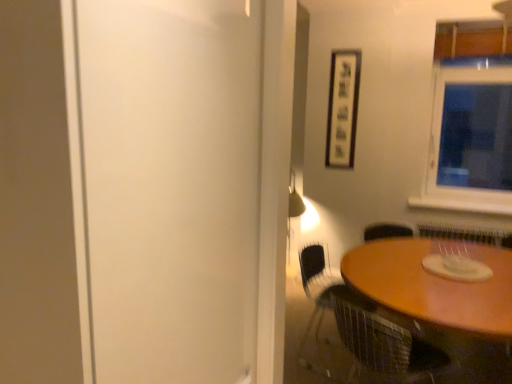
Question: Considering the relative positions of metal mesh chair at lower right and wooden table at lower right in the image provided, is metal mesh chair at lower right to the right of wooden table at lower right from the viewer's perspective?

Choices:
 (A) no
 (B) yes

Answer: (A)

Question: Can you confirm if metal mesh chair at lower right is taller than wooden table at lower right?

Choices:
 (A) no
 (B) yes

Answer: (A)

Question: From the image's perspective, is metal mesh chair at lower right located beneath wooden table at lower right?

Choices:
 (A) no
 (B) yes

Answer: (B)

Question: Is metal mesh chair at lower right touching wooden table at lower right?

Choices:
 (A) yes
 (B) no

Answer: (B)

Question: Does metal mesh chair at lower right appear on the left side of wooden table at lower right?

Choices:
 (A) yes
 (B) no

Answer: (A)

Question: Is white matte screen door at left wider or thinner than wooden table at lower right?

Choices:
 (A) thin
 (B) wide

Answer: (A)

Question: From a real-world perspective, is white matte screen door at left positioned above or below wooden table at lower right?

Choices:
 (A) below
 (B) above

Answer: (B)

Question: Is white matte screen door at left to the left or to the right of wooden table at lower right in the image?

Choices:
 (A) right
 (B) left

Answer: (B)

Question: Is point (184, 258) positioned closer to the camera than point (435, 326)?

Choices:
 (A) farther
 (B) closer

Answer: (B)

Question: From a real-world perspective, is wooden table at lower right above or below metal mesh chair at lower right?

Choices:
 (A) below
 (B) above

Answer: (A)

Question: Is wooden table at lower right wider or thinner than metal mesh chair at lower right?

Choices:
 (A) wide
 (B) thin

Answer: (A)

Question: In the image, is wooden table at lower right positioned in front of or behind metal mesh chair at lower right?

Choices:
 (A) front
 (B) behind

Answer: (A)

Question: Is wooden table at lower right spatially inside metal mesh chair at lower right, or outside of it?

Choices:
 (A) outside
 (B) inside

Answer: (A)

Question: From the image's perspective, is white matte screen door at left above or below metal mesh chair at lower right?

Choices:
 (A) below
 (B) above

Answer: (B)

Question: Based on their sizes in the image, would you say white matte screen door at left is bigger or smaller than metal mesh chair at lower right?

Choices:
 (A) big
 (B) small

Answer: (A)